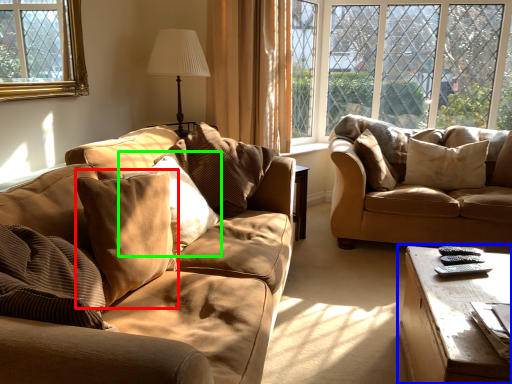
Question: Estimate the real-world distances between objects in this image. Which object is farther from pillow (highlighted by a red box), table (highlighted by a blue box) or pillow (highlighted by a green box)?

Choices:
 (A) table
 (B) pillow

Answer: (A)